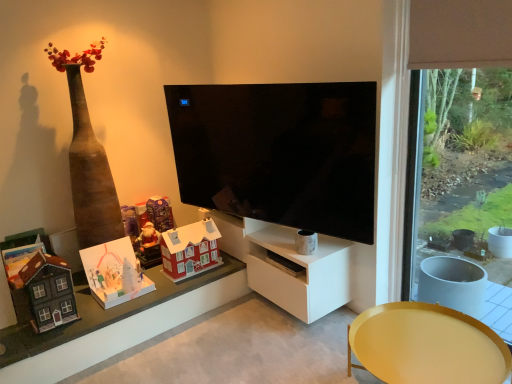
Where is `free space in front of white matte tv cabinet at center`? The image size is (512, 384). free space in front of white matte tv cabinet at center is located at coordinates (283, 347).